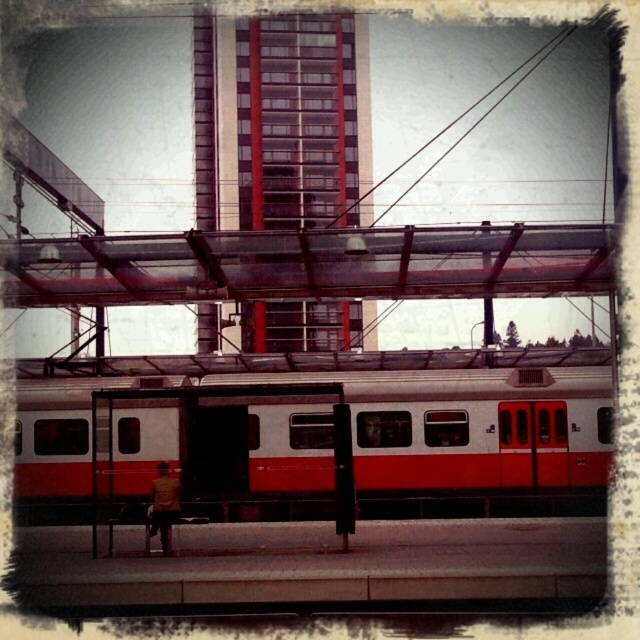
Which of these two, white glossy train at center or red glass building at center, stands shorter?

Standing shorter between the two is white glossy train at center.

Does white glossy train at center have a larger size compared to red glass building at center?

Incorrect, white glossy train at center is not larger than red glass building at center.

This screenshot has width=640, height=640. I want to click on white glossy train at center, so click(364, 433).